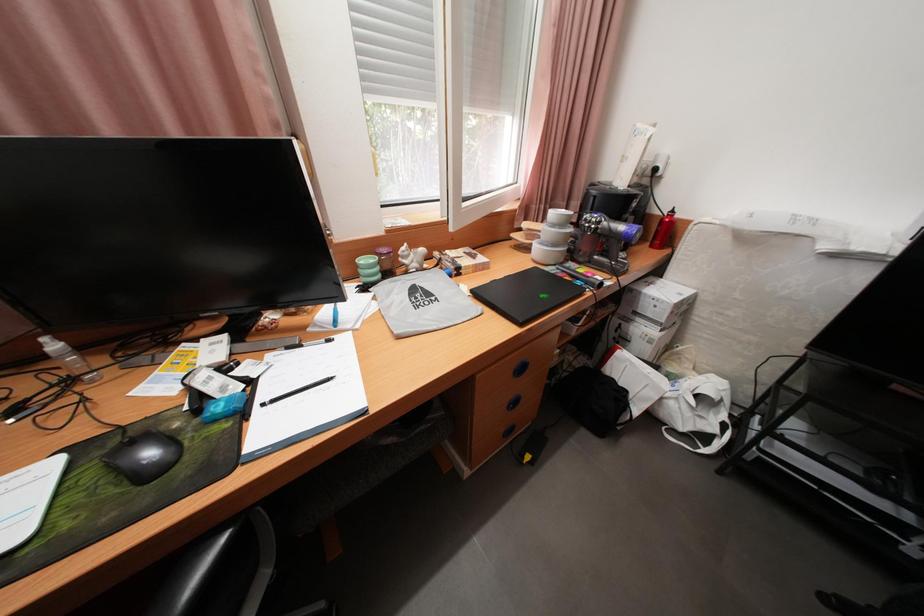
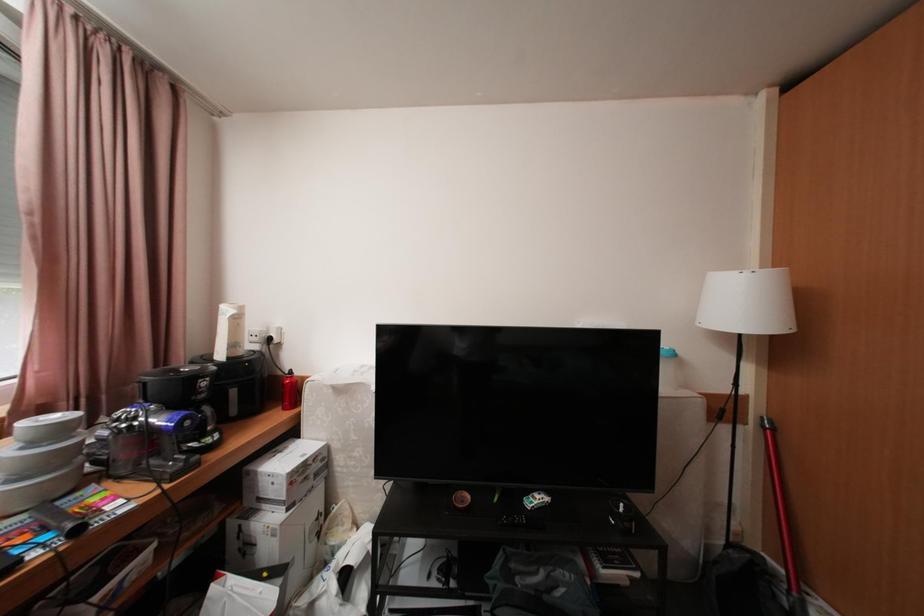
The images are taken continuously from a first-person perspective. In which direction is your viewpoint rotating?

The rotation direction of the camera is right-up.